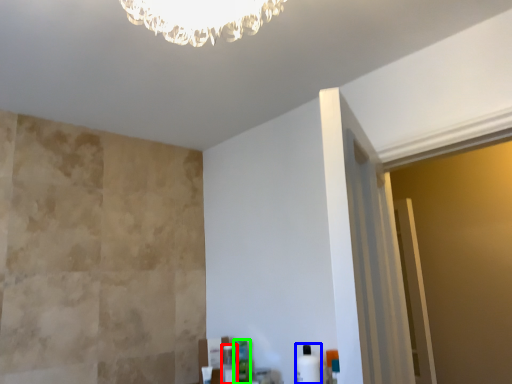
Question: Which object is the closest to the toiletry (highlighted by a red box)? Choose among these: toiletry (highlighted by a blue box) or toiletry (highlighted by a green box).

Choices:
 (A) toiletry
 (B) toiletry

Answer: (B)